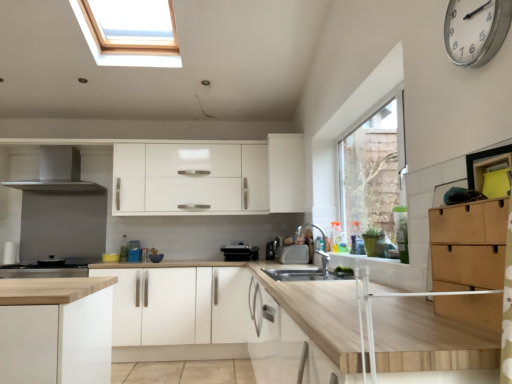
Question: In the image, is white matte cabinet at center, placed as the 1th cabinetry when sorted from bottom to top, positioned in front of or behind white matte cabinet at upper center, the 1th cabinetry when ordered from top to bottom?

Choices:
 (A) behind
 (B) front

Answer: (B)

Question: Visually, is white matte cabinet at center, which is the second cabinetry in back-to-front order, positioned to the left or to the right of white matte cabinet at upper center, the 3th cabinetry positioned from the front?

Choices:
 (A) left
 (B) right

Answer: (A)

Question: Which is farther from the white matte cabinet at center, which is counted as the second cabinetry, starting from the front?

Choices:
 (A) satin silver metallic range hood at upper left, acting as the first home appliance starting from the top
 (B) silver metallic faucet at center
 (C) stainless steel stove at lower left, which is the first home appliance in bottom-to-top order
 (D) satin silver toaster at center, the 2th appliance when ordered from left to right
 (E) wooden at center

Answer: (E)

Question: Which of these objects is positioned farthest from the wooden at center?

Choices:
 (A) satin silver toaster at center, which is the 2th appliance from right to left
 (B) light brown wood drawer at right, which ranks as the 3th cabinetry in left-to-right order
 (C) white matte cabinet at center, which is counted as the second cabinetry, starting from the front
 (D) satin silver metallic range hood at upper left, acting as the 2th home appliance starting from the bottom
 (E) silver metallic faucet at center

Answer: (D)